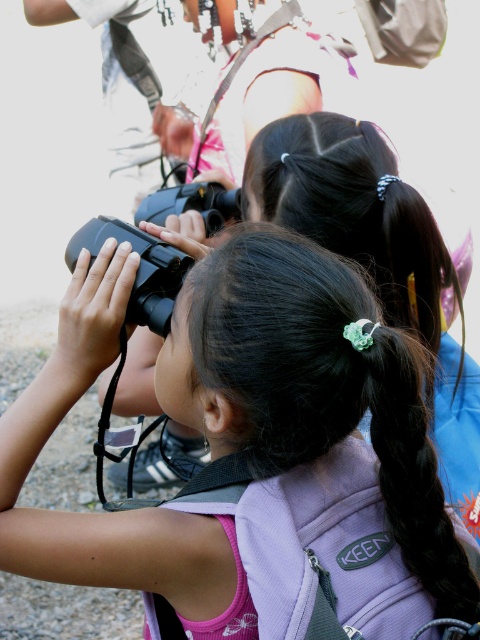
You are a photographer trying to capture a candid shot of the girl with the black silky hair at center. The black matte binoculars at center might block your view. Based on their positions, is the binoculars in front of or behind the girl?

The black matte binoculars at center are to the left of black silky hair at center, so they are positioned to the side rather than directly in front or behind. This means the binoculars are not blocking the view of the girl with black silky hair at center.

You are a photographer trying to capture a clear shot of the black silky hair at center. The black matte binoculars at center are blocking your view. Can you move the binoculars to the side to get an unobstructed view of the hair?

The black matte binoculars at center is above black silky hair at center, so moving the binoculars downward would allow you to see the black silky hair at center without obstruction.